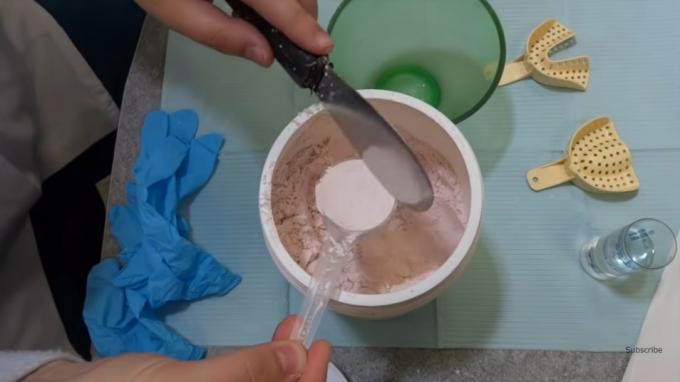
You are a GUI agent. You are given a task and a screenshot of the screen. Output one action in this format:
    pyautogui.click(x=<x>, y=<y>)
    Task: Click on the cup
    The height and width of the screenshot is (382, 680).
    Given the screenshot: What is the action you would take?
    pyautogui.click(x=336, y=248)